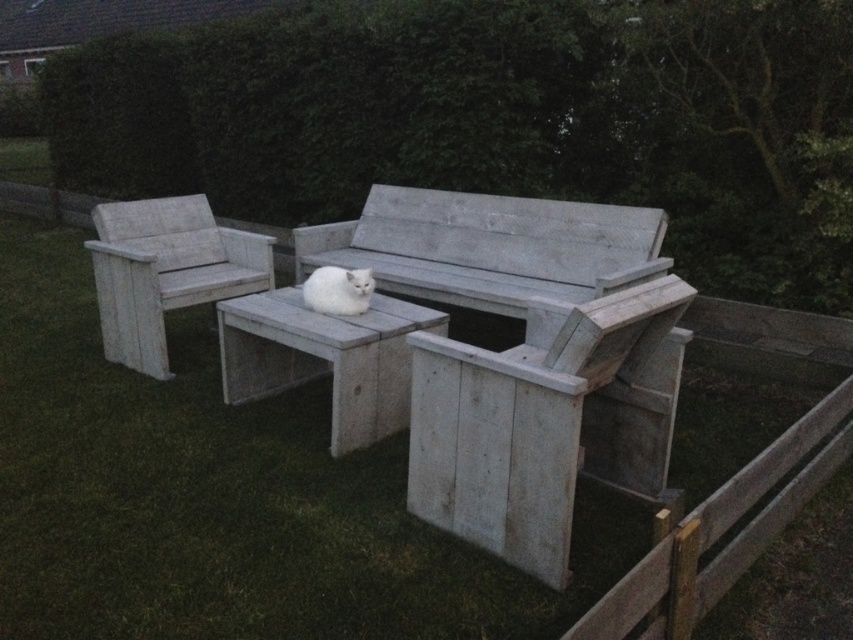
Question: Where is gray wooden bench at center located in relation to wooden bench at center in the image?

Choices:
 (A) left
 (B) right

Answer: (B)

Question: In this image, where is green leafy hedge at upper center located relative to gray wooden bench at center?

Choices:
 (A) left
 (B) right

Answer: (B)

Question: Which point appears farthest from the camera in this image?

Choices:
 (A) (810, 621)
 (B) (502, 353)

Answer: (B)

Question: Does green grass at center have a larger size compared to wooden bench at center?

Choices:
 (A) yes
 (B) no

Answer: (A)

Question: Which point is closer to the camera?

Choices:
 (A) (780, 157)
 (B) (252, 413)
 (C) (595, 468)
 (D) (347, 294)

Answer: (C)

Question: Which object is closer to the camera taking this photo?

Choices:
 (A) wooden bench at center
 (B) green leafy hedge at upper center
 (C) white wood bench at left

Answer: (A)